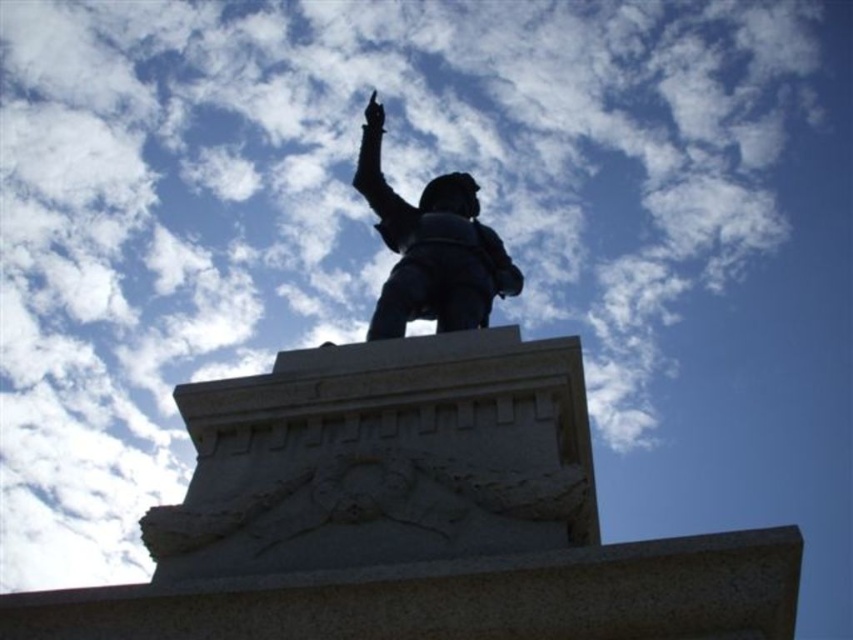
You are an art student who wants to paint the statue in the image. You have two canvases, one large enough for the black metal statue at center and another for the bronze statue at center. Which statue should you choose to paint on the larger canvas?

The black metal statue at center is bigger than the bronze statue at center, so you should choose to paint the black metal statue at center on the larger canvas.

Based on the photo, you are a tourist standing in front of the statue. You notice two statues at the center. Which one is closer to you, the black metal statue at center or the bronze statue at center?

The black metal statue at center is closer to you since it is in front of the bronze statue at center.